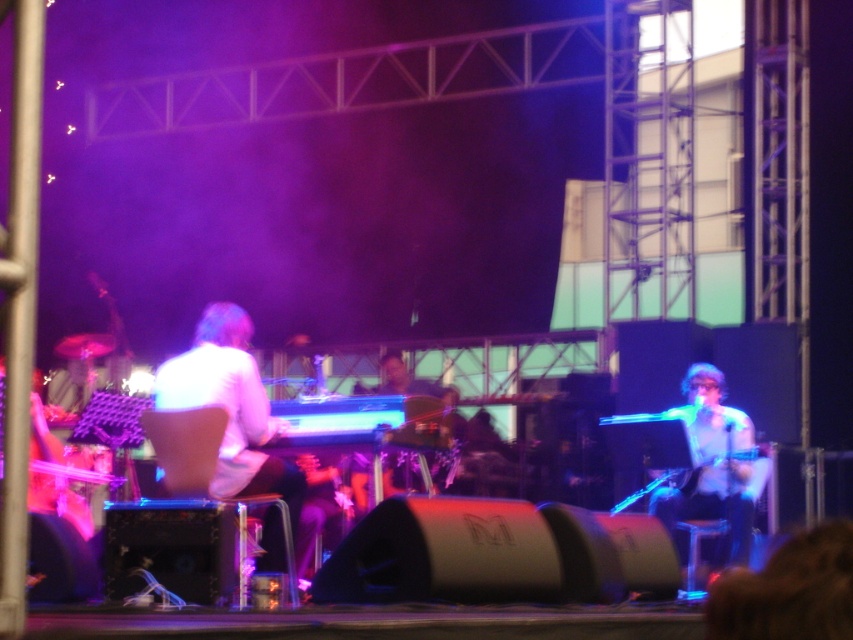
Question: Among these points, which one is farthest from the camera?

Choices:
 (A) (669, 412)
 (B) (242, 419)

Answer: (A)

Question: Can you confirm if white matte keyboardist at center is positioned to the right of white glossy microphone at center?

Choices:
 (A) no
 (B) yes

Answer: (A)

Question: Where is white matte keyboardist at center located in relation to white glossy microphone at center in the image?

Choices:
 (A) below
 (B) above

Answer: (B)

Question: Is white matte keyboardist at center to the left of white glossy microphone at center from the viewer's perspective?

Choices:
 (A) yes
 (B) no

Answer: (A)

Question: Which of the following is the farthest from the observer?

Choices:
 (A) white matte keyboardist at center
 (B) white glossy microphone at center

Answer: (B)